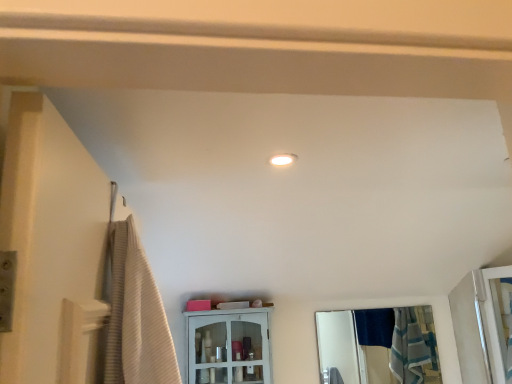
Question: From a real-world perspective, does clear glass mirror at center stand above white glossy cabinet at center?

Choices:
 (A) no
 (B) yes

Answer: (A)

Question: Is clear glass mirror at center not close to white glossy cabinet at center?

Choices:
 (A) yes
 (B) no

Answer: (A)

Question: Is clear glass mirror at center directly adjacent to white glossy cabinet at center?

Choices:
 (A) yes
 (B) no

Answer: (B)

Question: Would you say clear glass mirror at center is outside white glossy cabinet at center?

Choices:
 (A) yes
 (B) no

Answer: (A)

Question: From a real-world perspective, does clear glass mirror at center sit lower than white glossy cabinet at center?

Choices:
 (A) yes
 (B) no

Answer: (A)

Question: From the image's perspective, is clear glass mirror at center located above white glossy cabinet at center?

Choices:
 (A) yes
 (B) no

Answer: (B)

Question: Can you confirm if clear glass screen door at right is thinner than white glossy cabinet at center?

Choices:
 (A) yes
 (B) no

Answer: (B)

Question: Could you tell me if clear glass screen door at right is turned towards white glossy cabinet at center?

Choices:
 (A) no
 (B) yes

Answer: (A)

Question: From a real-world perspective, is clear glass screen door at right positioned under white glossy cabinet at center based on gravity?

Choices:
 (A) no
 (B) yes

Answer: (B)

Question: Is clear glass screen door at right outside of white glossy cabinet at center?

Choices:
 (A) yes
 (B) no

Answer: (A)

Question: Does clear glass screen door at right have a greater height compared to white glossy cabinet at center?

Choices:
 (A) no
 (B) yes

Answer: (B)

Question: Could white glossy cabinet at center be considered to be inside clear glass screen door at right?

Choices:
 (A) yes
 (B) no

Answer: (B)

Question: Is white glossy cabinet at center bigger than clear glass screen door at right?

Choices:
 (A) no
 (B) yes

Answer: (B)